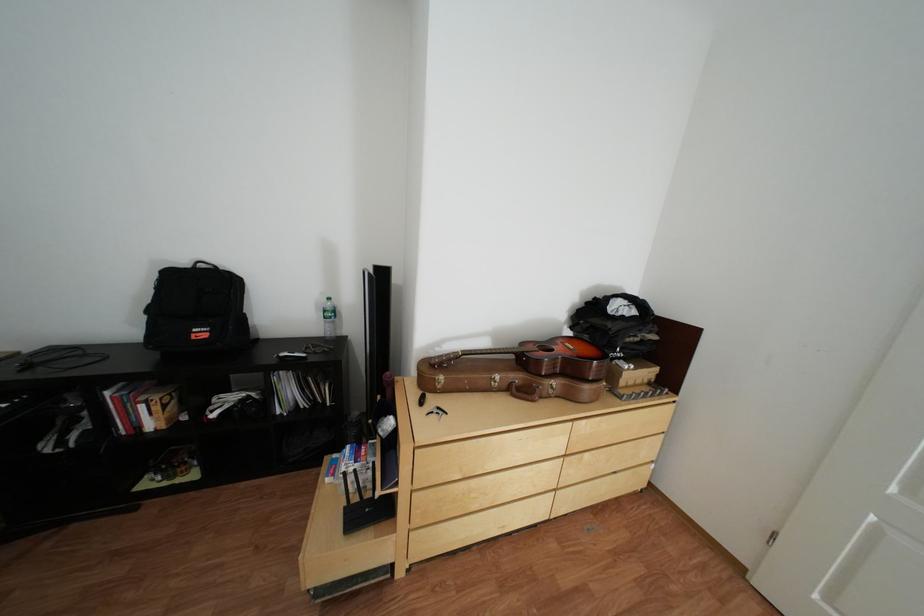
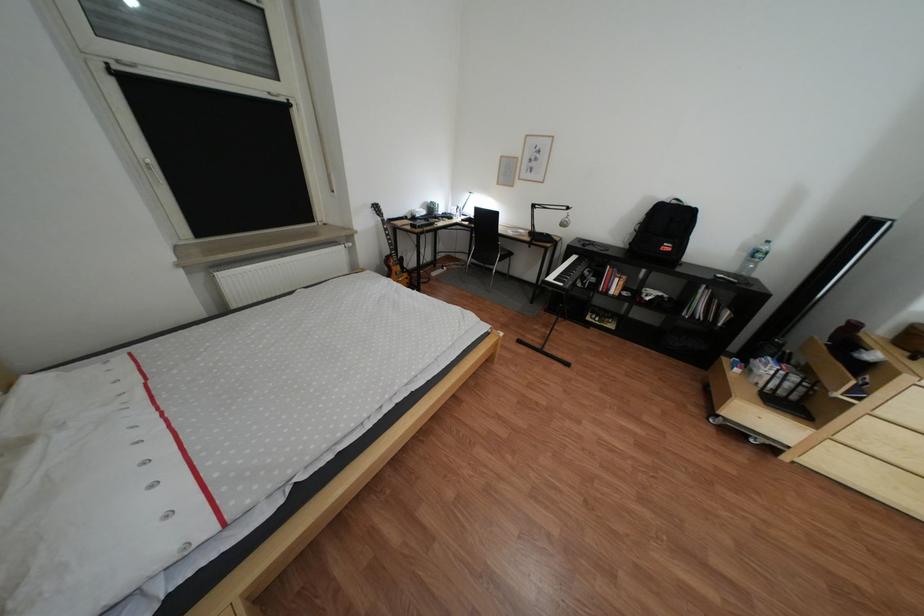
In the second image, find the point that corresponds to [216,334] in the first image.

(683, 248)